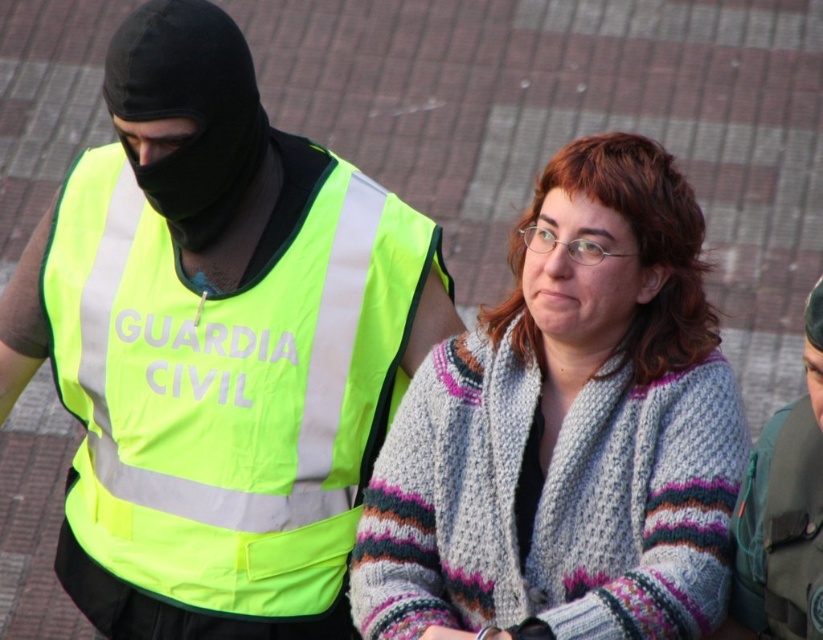
Does point (259, 358) come farther from viewer compared to point (561, 592)?

Yes, point (259, 358) is farther from viewer.

Who is more distant from viewer, (x=294, y=314) or (x=626, y=244)?

Positioned behind is point (x=294, y=314).

This screenshot has height=640, width=823. What are the coordinates of `neon yellow reflective vest at center` in the screenshot? It's located at (216, 344).